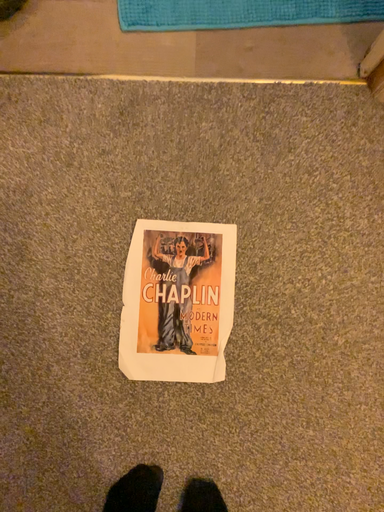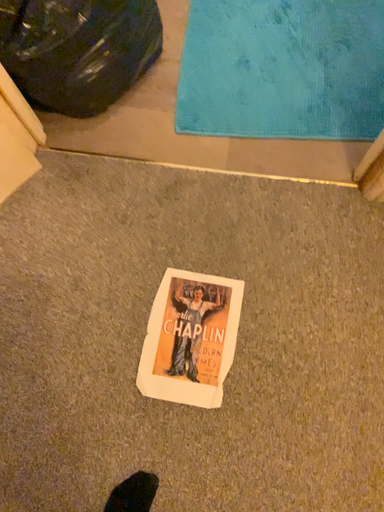
Question: Which way did the camera rotate in the video?

Choices:
 (A) rotated downward
 (B) rotated upward

Answer: (B)